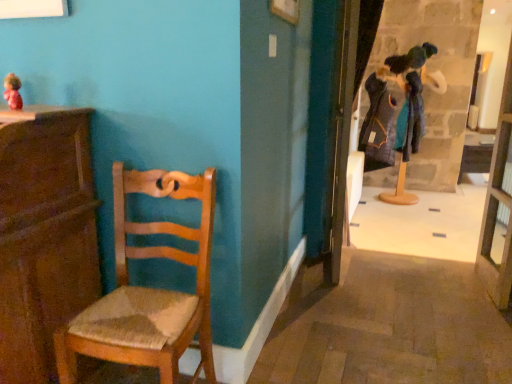
Question: Does matte pink doll at upper left have a lesser width compared to wooden door at center?

Choices:
 (A) no
 (B) yes

Answer: (B)

Question: Considering the relative positions of matte pink doll at upper left and wooden door at center in the image provided, is matte pink doll at upper left behind wooden door at center?

Choices:
 (A) yes
 (B) no

Answer: (B)

Question: Does matte pink doll at upper left have a greater height compared to wooden door at center?

Choices:
 (A) yes
 (B) no

Answer: (B)

Question: Is matte pink doll at upper left to the left of wooden door at center from the viewer's perspective?

Choices:
 (A) yes
 (B) no

Answer: (A)

Question: Can you confirm if matte pink doll at upper left is bigger than wooden door at center?

Choices:
 (A) no
 (B) yes

Answer: (A)

Question: From the image's perspective, is matte pink doll at upper left over wooden door at center?

Choices:
 (A) yes
 (B) no

Answer: (A)

Question: Is woven wood chair at left outside of wooden cabinet at left?

Choices:
 (A) yes
 (B) no

Answer: (A)

Question: Does woven wood chair at left appear on the right side of wooden cabinet at left?

Choices:
 (A) yes
 (B) no

Answer: (A)

Question: From a real-world perspective, is woven wood chair at left located higher than wooden cabinet at left?

Choices:
 (A) no
 (B) yes

Answer: (A)

Question: Is woven wood chair at left in contact with wooden cabinet at left?

Choices:
 (A) no
 (B) yes

Answer: (A)

Question: Considering the relative positions of woven wood chair at left and wooden cabinet at left in the image provided, is woven wood chair at left to the left of wooden cabinet at left from the viewer's perspective?

Choices:
 (A) yes
 (B) no

Answer: (B)

Question: Is woven wood chair at left behind wooden cabinet at left?

Choices:
 (A) no
 (B) yes

Answer: (A)

Question: Is wooden door at center far away from transparent glass door at right?

Choices:
 (A) yes
 (B) no

Answer: (B)